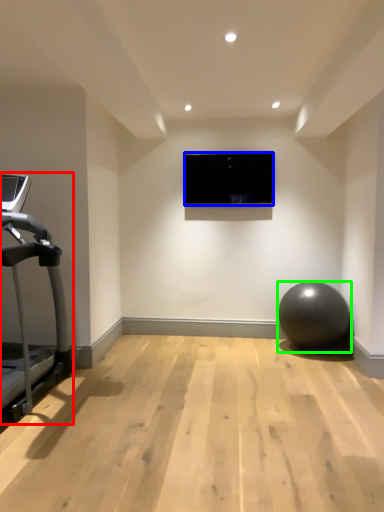
Question: Based on their relative distances, which object is nearer to treadmill (highlighted by a red box)? Choose from computer screen (highlighted by a blue box) and ball (highlighted by a green box).

Choices:
 (A) computer screen
 (B) ball

Answer: (A)